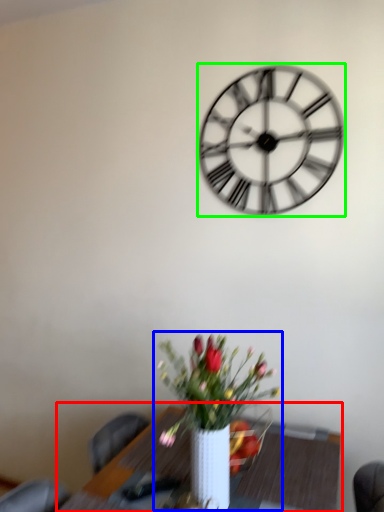
Question: Estimate the real-world distances between objects in this image. Which object is farther from table (highlighted by a red box), houseplant (highlighted by a blue box) or wall clock (highlighted by a green box)?

Choices:
 (A) houseplant
 (B) wall clock

Answer: (B)